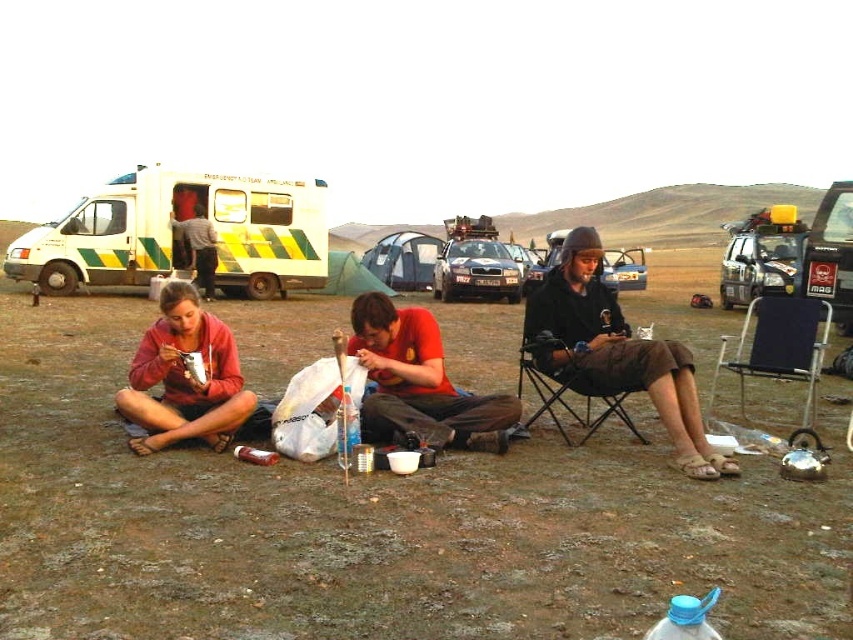
Looking at this image, you are a photographer trying to capture a group photo of the red cotton shirt at center and the gray fabric shirt at left. Based on their positions, which one should you place on your left side in the frame to maintain their original arrangement?

The gray fabric shirt at left should be placed on your left side in the frame because the red cotton shirt at center is positioned on the right side of the gray fabric shirt at left, so maintaining their original arrangement requires the gray fabric shirt at left to be on the left and the red cotton shirt at center on the right.

You are an observer standing in front of the scene. You notice two people wearing shirts. The first is wearing a red cotton shirt at center, and the second is wearing a gray fabric shirt at left. Which shirt is closer to you?

The red cotton shirt at center is closer to you because it is positioned under the gray fabric shirt at left, indicating it is in front.